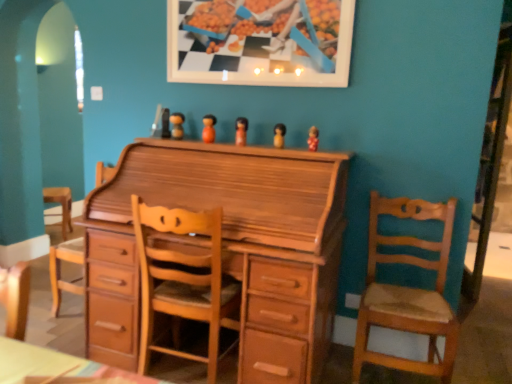
Where is `vacant space in front of brown wooden figurine at center, which ranks as the 4th toy in left-to-right order`? vacant space in front of brown wooden figurine at center, which ranks as the 4th toy in left-to-right order is located at coordinates (282, 150).